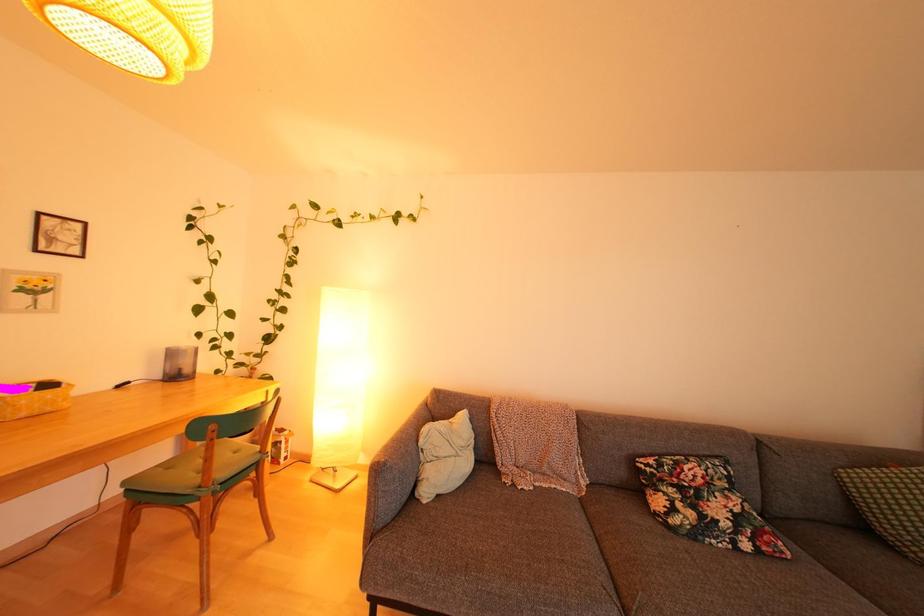
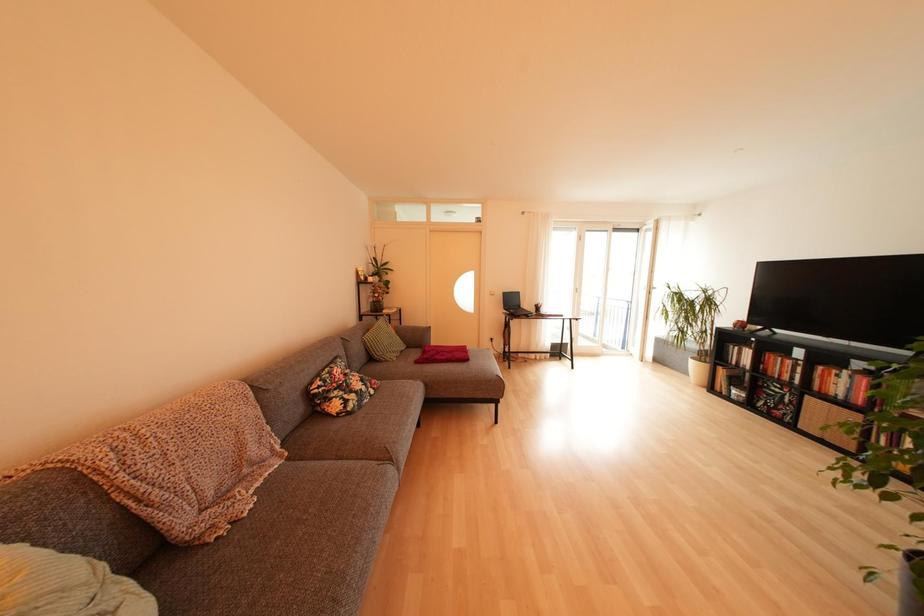
Question: The images are taken continuously from a first-person perspective. In which direction is your viewpoint rotating?

Choices:
 (A) Left
 (B) Right
 (C) Up
 (D) Down

Answer: (B)